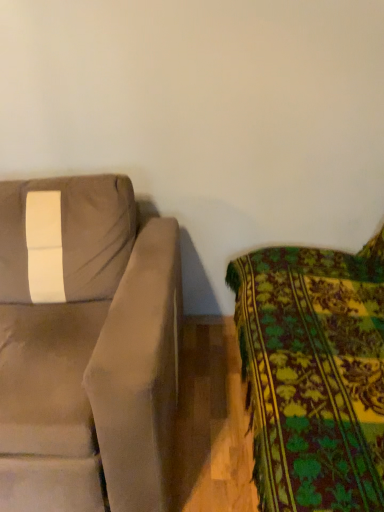
Question: Looking at their shapes, would you say floral fabric couch at right, the first studio couch when ordered from right to left, is wider or thinner than suede-like beige couch at left, acting as the second studio couch starting from the right?

Choices:
 (A) wide
 (B) thin

Answer: (B)

Question: Considering their positions, is floral fabric couch at right, which ranks as the 2th studio couch in left-to-right order, located in front of or behind suede-like beige couch at left, which is counted as the 1th studio couch, starting from the left?

Choices:
 (A) front
 (B) behind

Answer: (A)

Question: Is floral fabric couch at right, the first studio couch when ordered from right to left, inside or outside of suede-like beige couch at left, which is counted as the 1th studio couch, starting from the left?

Choices:
 (A) outside
 (B) inside

Answer: (A)

Question: Is suede-like beige couch at left, acting as the second studio couch starting from the right, taller or shorter than floral fabric couch at right, the first studio couch when ordered from right to left?

Choices:
 (A) tall
 (B) short

Answer: (B)

Question: Looking at the image, does suede-like beige couch at left, acting as the second studio couch starting from the right, seem bigger or smaller compared to floral fabric couch at right, the first studio couch when ordered from right to left?

Choices:
 (A) big
 (B) small

Answer: (B)

Question: Is point click(16, 320) positioned closer to the camera than point click(336, 267)?

Choices:
 (A) closer
 (B) farther

Answer: (A)

Question: In terms of width, does suede-like beige couch at left, acting as the second studio couch starting from the right, look wider or thinner when compared to floral fabric couch at right, the first studio couch when ordered from right to left?

Choices:
 (A) wide
 (B) thin

Answer: (A)